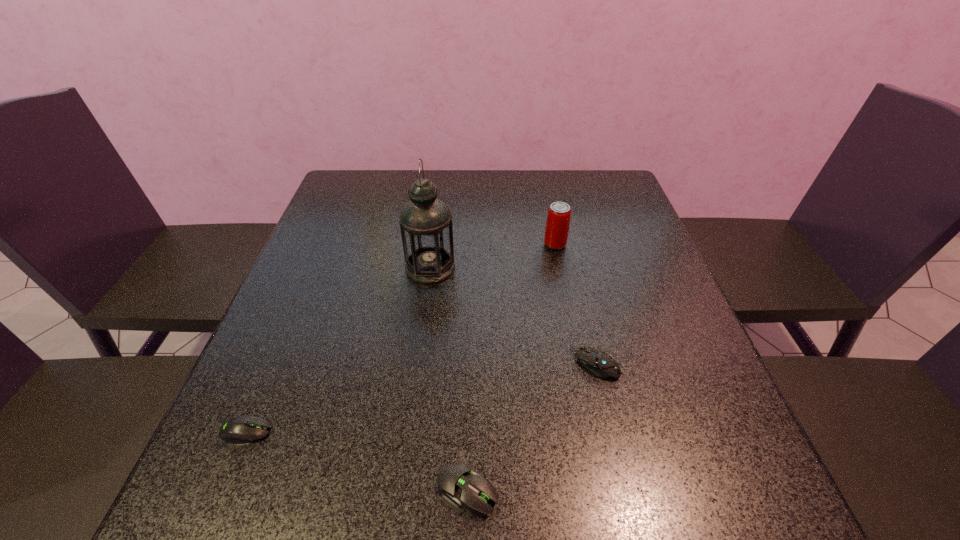
You are a GUI agent. You are given a task and a screenshot of the screen. Output one action in this format:
    pyautogui.click(x=<x>, y=<y>)
    Task: Click on the free space between the nearest computer mouse and the second farthest computer mouse
    This screenshot has width=960, height=540.
    Given the screenshot: What is the action you would take?
    coord(357,461)

Image resolution: width=960 pixels, height=540 pixels. I want to click on free space between the oil lamp and the second computer mouse from left to right, so click(x=449, y=379).

Locate which object ranks fourth in proximity to the farthest computer mouse. Please provide its 2D coordinates. Your answer should be formatted as a tuple, i.e. [(x, y)], where the tuple contains the x and y coordinates of a point satisfying the conditions above.

[(243, 429)]

What are the coordinates of `object that stands as the closest to the leftmost object` in the screenshot? It's located at (459, 485).

This screenshot has height=540, width=960. What are the coordinates of `computer mouse identified as the closest to the rightmost computer mouse` in the screenshot? It's located at (459, 485).

Locate which computer mouse is the closest to the nearest object. Please provide its 2D coordinates. Your answer should be formatted as a tuple, i.e. [(x, y)], where the tuple contains the x and y coordinates of a point satisfying the conditions above.

[(598, 362)]

Locate an element on the screen. This screenshot has height=540, width=960. free space that satisfies the following two spatial constraints: 1. on the front side of the tallest object; 2. on the left side of the third farthest object is located at coordinates (418, 363).

Where is `vacant region that satisfies the following two spatial constraints: 1. on the wheel side of the second computer mouse from left to right; 2. on the right side of the leftmost computer mouse`? vacant region that satisfies the following two spatial constraints: 1. on the wheel side of the second computer mouse from left to right; 2. on the right side of the leftmost computer mouse is located at coordinates (222, 489).